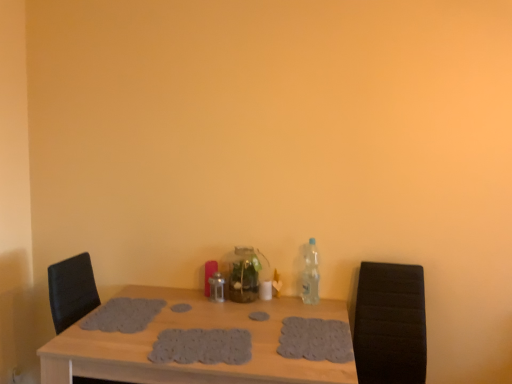
You are a GUI agent. You are given a task and a screenshot of the screen. Output one action in this format:
    pyautogui.click(x=<x>, y=<y>)
    Task: Click on the vacant space to the right of gray crocheted placemat at center, the fourth footprint viewed from the right
    
    Given the screenshot: What is the action you would take?
    (x=193, y=315)